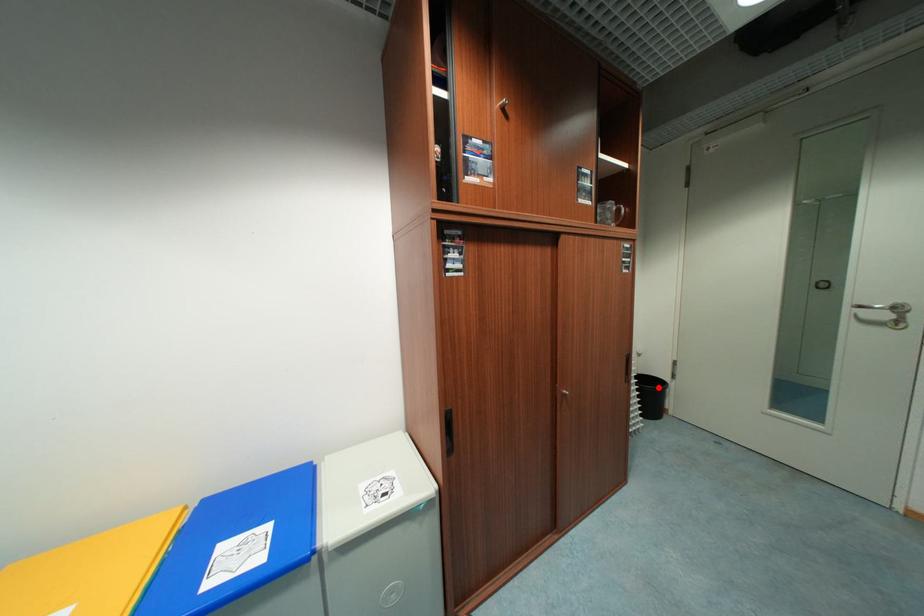
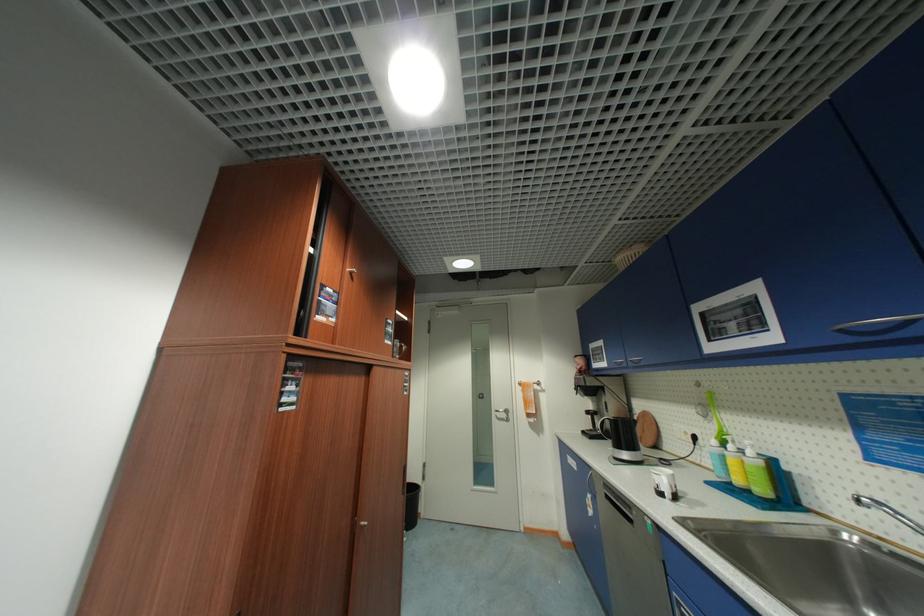
Question: A red point is marked in image1. In image2, is the corresponding 3D point closer to the camera or farther? Reply with the corresponding letter.

Choices:
 (A) The corresponding 3D point is closer.
 (B) The corresponding 3D point is farther.

Answer: (A)